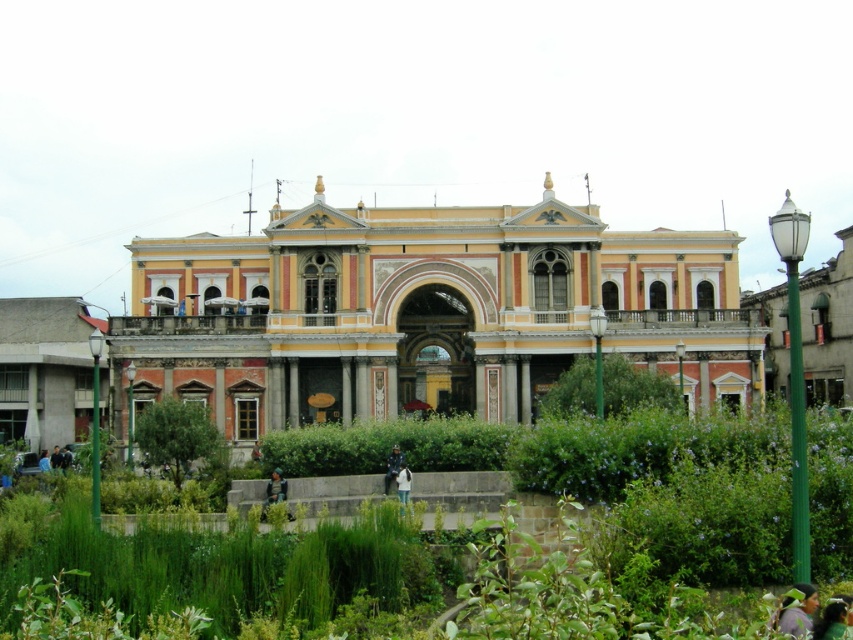
You are a tailor who needs to determine which clothing item takes up more horizontal space when laid flat. Based on the image, which item is wider between the camouflage fabric jacket at lower center and the white cotton shirt at lower center?

The camouflage fabric jacket at lower center has a lesser width compared to the white cotton shirt at lower center, so the white cotton shirt at lower center is wider.

You are standing in front of the grand building and notice a green leafy bush at center and a green fabric bag at center. Which object is positioned higher relative to the other?

The green leafy bush at center is located above the green fabric bag at center, so it is positioned higher.